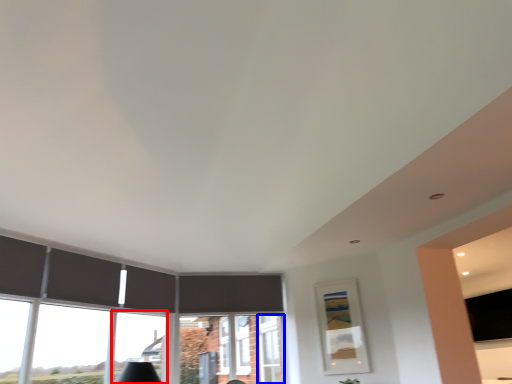
Question: Which of the following is the closest to the observer, window (highlighted by a red box) or window frame (highlighted by a blue box)?

Choices:
 (A) window
 (B) window frame

Answer: (A)